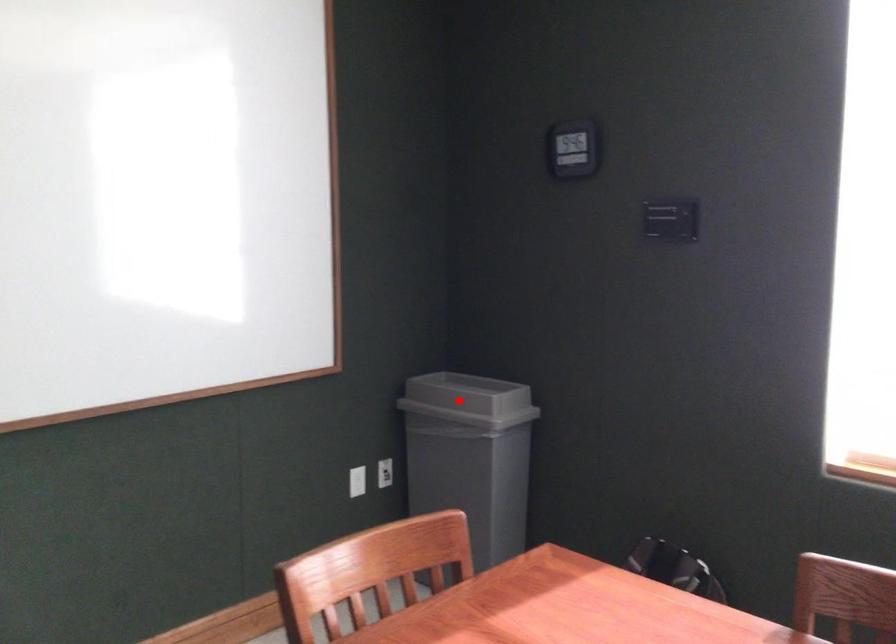
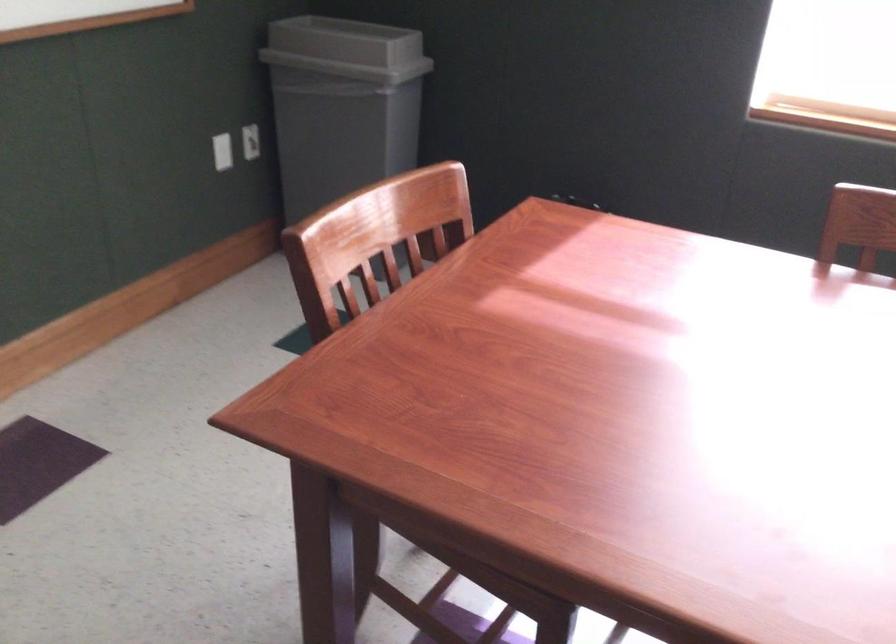
Question: I am providing you with two images of the same scene from different viewpoints. Image1 has a red point marked. In image2, the corresponding 3D location appears at what relative position? Reply with the corresponding letter.

Choices:
 (A) Closer
 (B) Farther

Answer: (A)